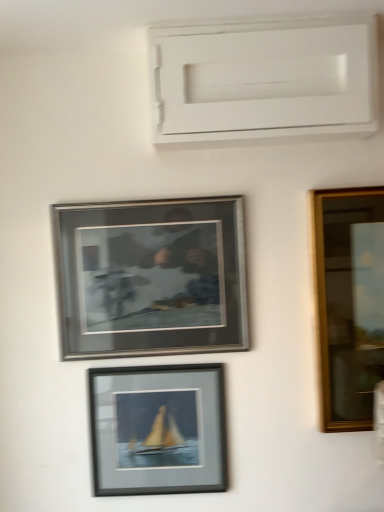
Question: Which direction should I rotate to look at silver metallic frame at center, the 2th picture frame when ordered from bottom to top, — up or down?

Choices:
 (A) up
 (B) down

Answer: (B)

Question: Does silver metallic frame at center, which is the first picture frame from top to bottom, have a smaller size compared to matte black frame at center, the first picture frame when ordered from bottom to top?

Choices:
 (A) yes
 (B) no

Answer: (B)

Question: Is silver metallic frame at center, which is the first picture frame from top to bottom, to the left of matte black frame at center, marked as the second picture frame in a top-to-bottom arrangement, from the viewer's perspective?

Choices:
 (A) no
 (B) yes

Answer: (B)

Question: Can you confirm if silver metallic frame at center, which is the first picture frame from top to bottom, is shorter than matte black frame at center, the first picture frame when ordered from bottom to top?

Choices:
 (A) no
 (B) yes

Answer: (A)

Question: Is silver metallic frame at center, which is the first picture frame from top to bottom, positioned in front of matte black frame at center, marked as the second picture frame in a top-to-bottom arrangement?

Choices:
 (A) no
 (B) yes

Answer: (B)

Question: Is silver metallic frame at center, the 2th picture frame when ordered from bottom to top, placed right next to matte black frame at center, the first picture frame when ordered from bottom to top?

Choices:
 (A) no
 (B) yes

Answer: (A)

Question: From the image's perspective, is silver metallic frame at center, the 2th picture frame when ordered from bottom to top, located above matte black frame at center, the first picture frame when ordered from bottom to top?

Choices:
 (A) no
 (B) yes

Answer: (B)

Question: Is matte black frame at center, marked as the second picture frame in a top-to-bottom arrangement, positioned with its back to white matte window frame at upper center?

Choices:
 (A) no
 (B) yes

Answer: (A)

Question: Can you confirm if matte black frame at center, the first picture frame when ordered from bottom to top, is taller than white matte window frame at upper center?

Choices:
 (A) yes
 (B) no

Answer: (A)

Question: Is matte black frame at center, the first picture frame when ordered from bottom to top, aimed at white matte window frame at upper center?

Choices:
 (A) no
 (B) yes

Answer: (A)

Question: From a real-world perspective, is matte black frame at center, the first picture frame when ordered from bottom to top, under white matte window frame at upper center?

Choices:
 (A) no
 (B) yes

Answer: (B)

Question: From a real-world perspective, does matte black frame at center, the first picture frame when ordered from bottom to top, stand above white matte window frame at upper center?

Choices:
 (A) no
 (B) yes

Answer: (A)

Question: Would you say white matte window frame at upper center is part of matte black frame at center, the first picture frame when ordered from bottom to top,'s contents?

Choices:
 (A) yes
 (B) no

Answer: (B)

Question: Considering the relative positions of matte black frame at center, marked as the second picture frame in a top-to-bottom arrangement, and silver metallic frame at center, the 2th picture frame when ordered from bottom to top, in the image provided, is matte black frame at center, marked as the second picture frame in a top-to-bottom arrangement, to the right of silver metallic frame at center, the 2th picture frame when ordered from bottom to top, from the viewer's perspective?

Choices:
 (A) yes
 (B) no

Answer: (A)